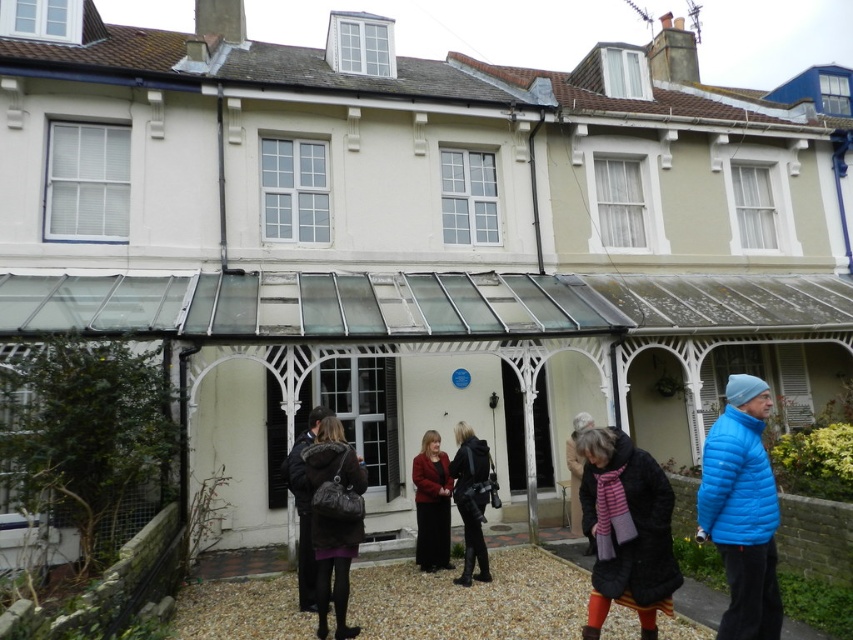
Can you confirm if matte red coat at center is positioned to the right of dark gray wool coat at lower left?

Correct, you'll find matte red coat at center to the right of dark gray wool coat at lower left.

Is matte red coat at center closer to camera compared to dark gray wool coat at lower left?

No, it is behind dark gray wool coat at lower left.

Between point (434, 520) and point (302, 506), which one is positioned in front?

Point (302, 506) is more forward.

The height and width of the screenshot is (640, 853). What are the coordinates of `matte red coat at center` in the screenshot? It's located at (431, 504).

Who is taller, matte black coat at lower left or black leather jacket at center?

With more height is matte black coat at lower left.

In the scene shown: Can you confirm if matte black coat at lower left is bigger than black leather jacket at center?

Incorrect, matte black coat at lower left is not larger than black leather jacket at center.

The height and width of the screenshot is (640, 853). What are the coordinates of `matte black coat at lower left` in the screenshot? It's located at (334, 568).

Locate an element on the screen. matte black coat at lower left is located at coordinates (334, 568).

Is blue down jacket at right bigger than black leather jacket at center?

No, blue down jacket at right is not bigger than black leather jacket at center.

Who is lower down, blue down jacket at right or black leather jacket at center?

black leather jacket at center is lower down.

Which is in front, point (708, 490) or point (480, 576)?

Positioned in front is point (708, 490).

Image resolution: width=853 pixels, height=640 pixels. What are the coordinates of `blue down jacket at right` in the screenshot? It's located at pos(741,509).